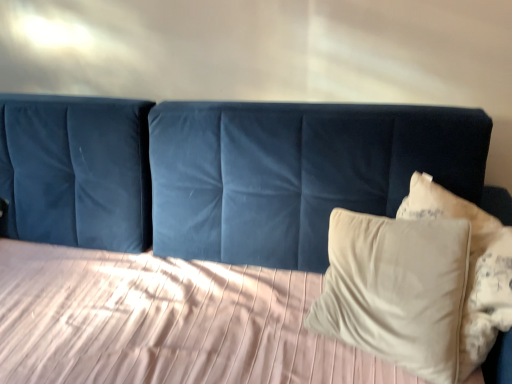
I want to click on beige soft pillow at right, so click(396, 290).

The image size is (512, 384). Describe the element at coordinates (396, 290) in the screenshot. I see `beige soft pillow at right` at that location.

Where is `beige soft pillow at right`? The height and width of the screenshot is (384, 512). beige soft pillow at right is located at coordinates (396, 290).